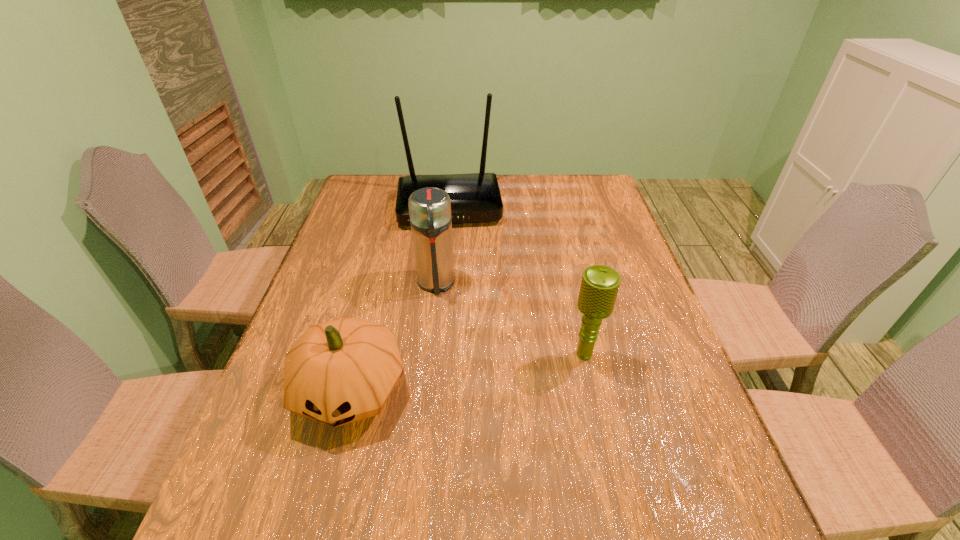
Find the location of `vacant area at the far left corner`. vacant area at the far left corner is located at coordinates (371, 175).

The height and width of the screenshot is (540, 960). In the image, there is a desktop. In order to click on vacant space at the near left corner in this screenshot , I will do `click(243, 456)`.

The height and width of the screenshot is (540, 960). I want to click on free spot at the far right corner of the desktop, so click(x=566, y=195).

The image size is (960, 540). I want to click on free space between the third nearest object and the microphone, so click(x=510, y=319).

Where is `free space between the microphone and the third nearest object`? The image size is (960, 540). free space between the microphone and the third nearest object is located at coordinates (510, 319).

The height and width of the screenshot is (540, 960). What are the coordinates of `free area in between the rightmost object and the third nearest object` in the screenshot? It's located at (510, 319).

The width and height of the screenshot is (960, 540). Find the location of `vacant space that's between the thermos bottle and the microphone`. vacant space that's between the thermos bottle and the microphone is located at coordinates (510, 319).

At what (x,y) coordinates should I click in order to perform the action: click on free space between the microphone and the second farthest object. Please return your answer as a coordinate pair (x, y). The height and width of the screenshot is (540, 960). Looking at the image, I should click on (510, 319).

Select which object appears as the third closest to the gourd. Please provide its 2D coordinates. Your answer should be formatted as a tuple, i.e. [(x, y)], where the tuple contains the x and y coordinates of a point satisfying the conditions above.

[(475, 197)]

This screenshot has width=960, height=540. In order to click on object that can be found as the closest to the router in this screenshot , I will do `click(429, 208)`.